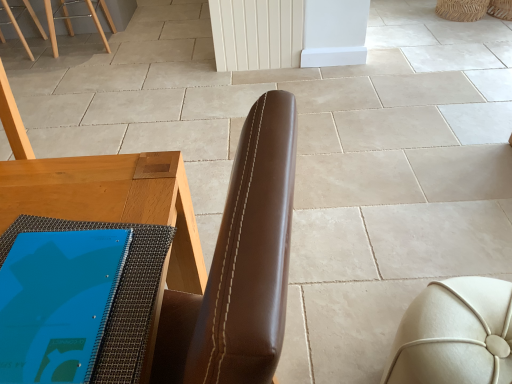
Question: Is brown leather chair at center with white leather ottoman at lower right?

Choices:
 (A) yes
 (B) no

Answer: (B)

Question: Does brown leather chair at center lie in front of white leather ottoman at lower right?

Choices:
 (A) no
 (B) yes

Answer: (B)

Question: Is brown leather chair at center wider than white leather ottoman at lower right?

Choices:
 (A) no
 (B) yes

Answer: (B)

Question: Does brown leather chair at center come behind white leather ottoman at lower right?

Choices:
 (A) no
 (B) yes

Answer: (A)

Question: Is white leather ottoman at lower right at the back of brown leather chair at center?

Choices:
 (A) yes
 (B) no

Answer: (A)

Question: From a real-world perspective, is brown leather chair at center physically above white leather ottoman at lower right?

Choices:
 (A) yes
 (B) no

Answer: (A)

Question: Does white leather ottoman at lower right have a larger size compared to brown leather chair at center?

Choices:
 (A) no
 (B) yes

Answer: (A)

Question: From the image's perspective, does white leather ottoman at lower right appear lower than brown leather chair at center?

Choices:
 (A) no
 (B) yes

Answer: (B)

Question: Is white leather ottoman at lower right positioned beyond the bounds of brown leather chair at center?

Choices:
 (A) no
 (B) yes

Answer: (B)

Question: Considering the relative positions of white leather ottoman at lower right and brown leather chair at center in the image provided, is white leather ottoman at lower right behind brown leather chair at center?

Choices:
 (A) no
 (B) yes

Answer: (B)

Question: From the image's perspective, is white leather ottoman at lower right above brown leather chair at center?

Choices:
 (A) no
 (B) yes

Answer: (A)

Question: Is white leather ottoman at lower right thinner than brown leather chair at center?

Choices:
 (A) no
 (B) yes

Answer: (B)

Question: Is brown leather chair at center spatially inside white leather ottoman at lower right, or outside of it?

Choices:
 (A) outside
 (B) inside

Answer: (A)